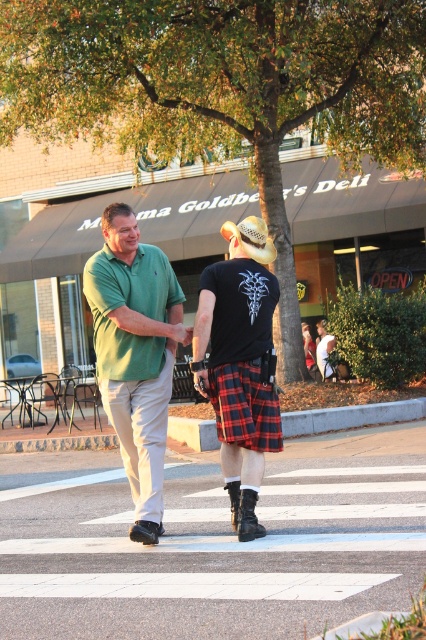
Question: Can you confirm if green cotton polo shirt at center is wider than tan straw cowboy hat at center?

Choices:
 (A) no
 (B) yes

Answer: (B)

Question: Which of the following is the farthest from the observer?

Choices:
 (A) (230, 474)
 (B) (261, 246)
 (C) (86, 275)
 (D) (242, 396)

Answer: (A)

Question: Can you confirm if green cotton polo shirt at center is positioned below tan straw cowboy hat at center?

Choices:
 (A) yes
 (B) no

Answer: (A)

Question: Which of the following is the closest to the observer?

Choices:
 (A) red plaid kilt at center
 (B) green cotton polo shirt at center
 (C) tan straw cowboy hat at center
 (D) plaid fabric at center

Answer: (D)

Question: Which object is positioned farthest from the red plaid kilt at center?

Choices:
 (A) plaid fabric at center
 (B) tan straw cowboy hat at center
 (C) green cotton polo shirt at center

Answer: (B)

Question: Where is plaid fabric at center located in relation to red plaid kilt at center in the image?

Choices:
 (A) right
 (B) left

Answer: (B)